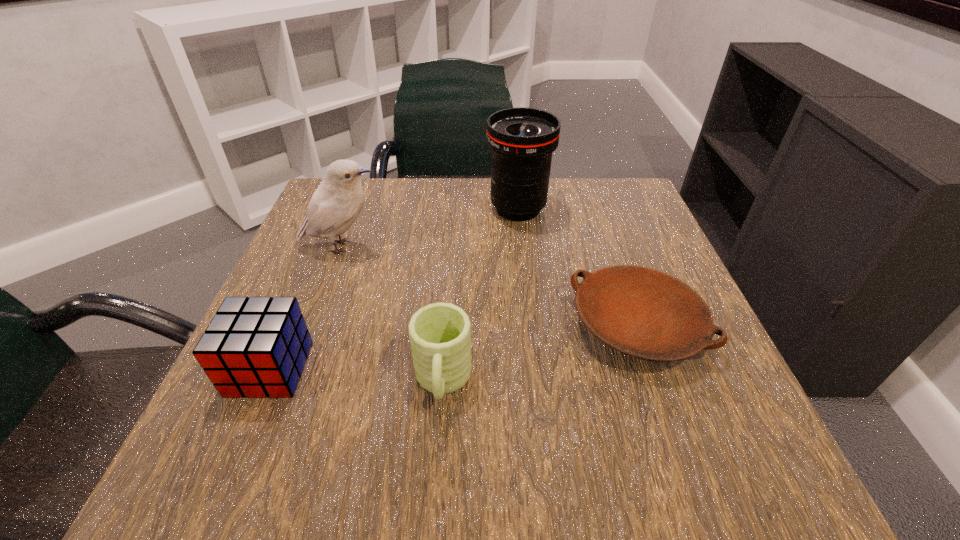
Find the location of `free space between the bird and the cube`. free space between the bird and the cube is located at coordinates (306, 308).

Where is `empty location between the third object from left to right and the cube`? The image size is (960, 540). empty location between the third object from left to right and the cube is located at coordinates (356, 375).

In order to click on empty space between the fourth nearest object and the cube in this screenshot , I will do `click(306, 308)`.

Identify the location of free area in between the third object from left to right and the shortest object. 540,354.

You are a GUI agent. You are given a task and a screenshot of the screen. Output one action in this format:
    pyautogui.click(x=<x>, y=<y>)
    Task: Click on the unoccupied position between the bird and the third object from left to right
    
    Given the screenshot: What is the action you would take?
    pyautogui.click(x=393, y=314)

Find the location of a particular element. This screenshot has height=540, width=960. empty space between the farthest object and the mug is located at coordinates (480, 295).

In order to click on vacant point located between the bird and the cube in this screenshot , I will do `click(306, 308)`.

At what (x,y) coordinates should I click in order to perform the action: click on vacant region between the mug and the shortest object. Please return your answer as a coordinate pair (x, y). The image size is (960, 540). Looking at the image, I should click on (540, 354).

You are a GUI agent. You are given a task and a screenshot of the screen. Output one action in this format:
    pyautogui.click(x=<x>, y=<y>)
    Task: Click on the vacant space that is in between the third object from left to right and the shortest object
    
    Given the screenshot: What is the action you would take?
    pyautogui.click(x=540, y=354)

Find the location of a particular element. The height and width of the screenshot is (540, 960). object that is the second closest to the plate is located at coordinates (521, 139).